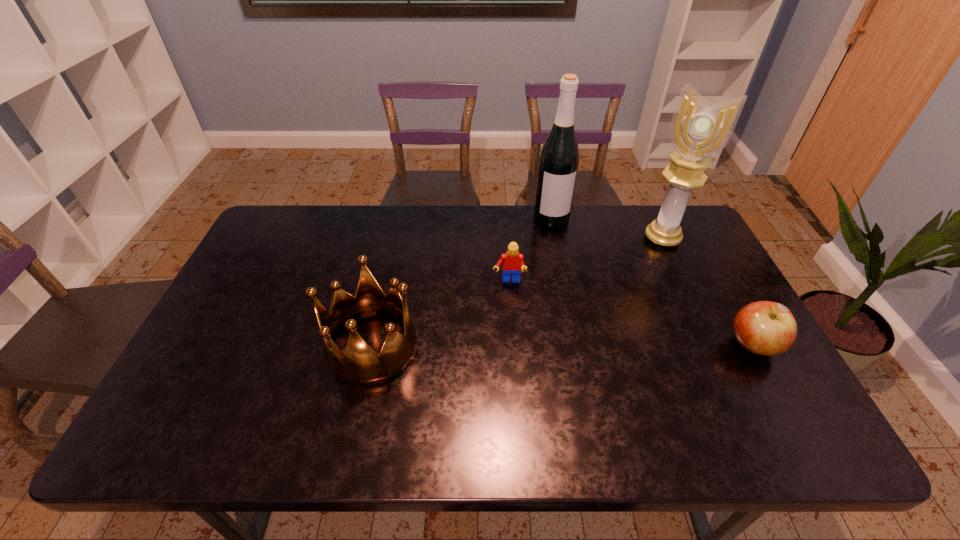
Where is `object that is at the near edge`? This screenshot has width=960, height=540. object that is at the near edge is located at coordinates (361, 366).

Image resolution: width=960 pixels, height=540 pixels. Identify the location of apple situated at the right edge. (766, 328).

Locate an element on the screen. This screenshot has height=540, width=960. award that is at the right edge is located at coordinates (698, 130).

At what (x,y) coordinates should I click in order to perform the action: click on object at the far right corner. Please return your answer as a coordinate pair (x, y). This screenshot has width=960, height=540. Looking at the image, I should click on (698, 130).

Where is `vacant space at the far edge of the desktop`? Image resolution: width=960 pixels, height=540 pixels. vacant space at the far edge of the desktop is located at coordinates (329, 226).

Where is `vacant space at the near edge of the desktop`? Image resolution: width=960 pixels, height=540 pixels. vacant space at the near edge of the desktop is located at coordinates (657, 375).

Locate an element on the screen. Image resolution: width=960 pixels, height=540 pixels. free spot at the left edge of the desktop is located at coordinates (195, 361).

The height and width of the screenshot is (540, 960). Identify the location of free space at the right edge of the desktop. (731, 350).

Locate an element on the screen. The width and height of the screenshot is (960, 540). free space between the third object from right to left and the third farthest object is located at coordinates (530, 250).

Where is `empty space between the award and the second object from left to right`? The width and height of the screenshot is (960, 540). empty space between the award and the second object from left to right is located at coordinates (586, 260).